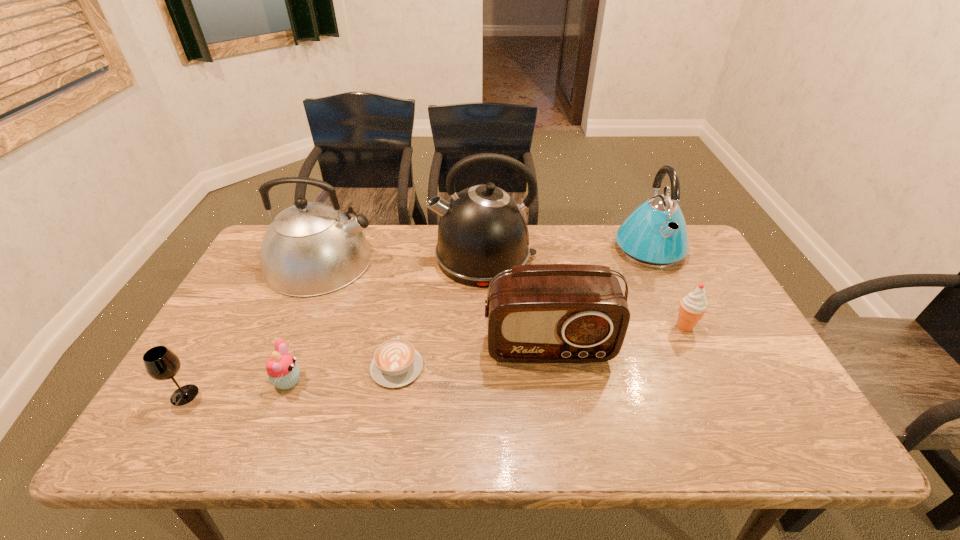
Find the location of a particular element. The image size is (960, 540). free space located on the spout of the tallest object is located at coordinates (390, 258).

Where is `free space located on the spout of the tallest object`? free space located on the spout of the tallest object is located at coordinates (349, 258).

Find the location of a particular element. The image size is (960, 540). free location located from the spout of the leftmost kettle is located at coordinates (429, 261).

Where is `blank area located 0.370m at the spout of the rightmost kettle`? The width and height of the screenshot is (960, 540). blank area located 0.370m at the spout of the rightmost kettle is located at coordinates (707, 370).

Where is `vacant space located 0.190m on the front panel of the radio receiver`? vacant space located 0.190m on the front panel of the radio receiver is located at coordinates (563, 435).

The width and height of the screenshot is (960, 540). Identify the location of free space located on the left of the icecream. (606, 326).

The height and width of the screenshot is (540, 960). I want to click on vacant area situated on the right of the wineglass, so tap(287, 395).

At what (x,y) coordinates should I click in order to perform the action: click on free space located 0.130m on the face of the cupcake. Please return your answer as a coordinate pair (x, y). This screenshot has height=540, width=960. Looking at the image, I should click on (356, 381).

Where is `vacant space located 0.400m on the side of the shortest object with the handle`? The height and width of the screenshot is (540, 960). vacant space located 0.400m on the side of the shortest object with the handle is located at coordinates (418, 251).

Locate an element on the screen. vacant region located on the side of the shortest object with the handle is located at coordinates (403, 330).